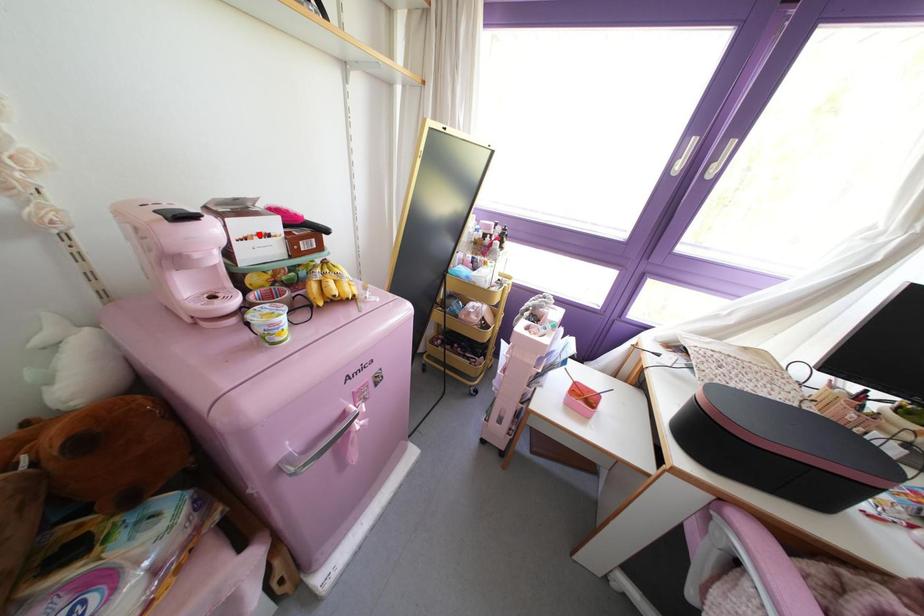
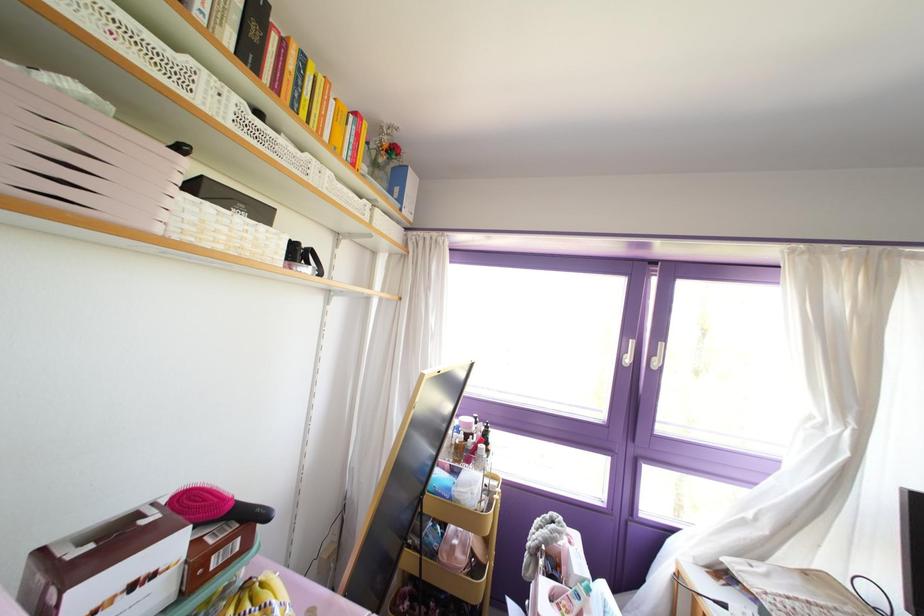
Find the pixel in the second image that matches the highlighted location in the first image.

(132, 586)